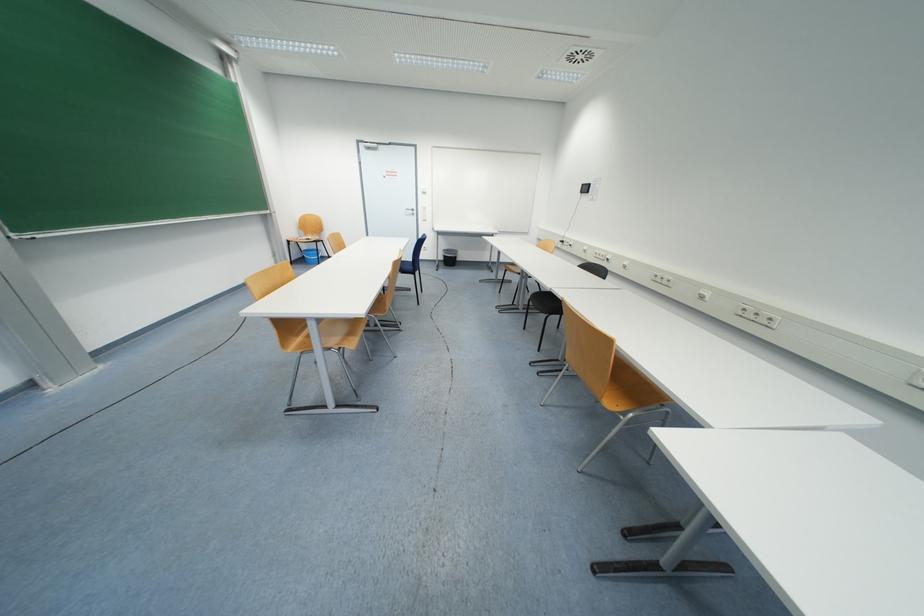
This screenshot has width=924, height=616. I want to click on metal door handle, so click(409, 211).